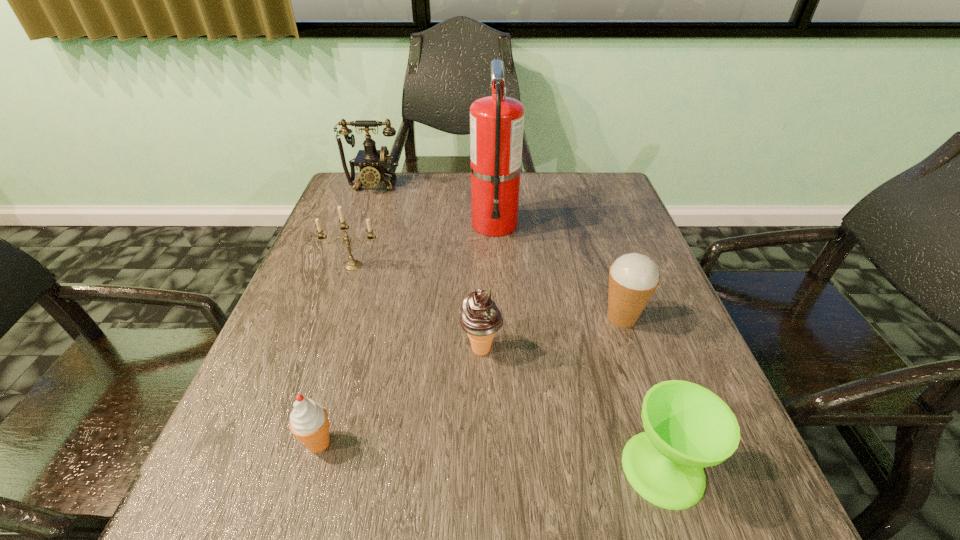
At what (x,y) coordinates should I click in order to perform the action: click on vacant space at the right edge of the desktop. Please return your answer as a coordinate pair (x, y). Looking at the image, I should click on click(x=588, y=248).

Image resolution: width=960 pixels, height=540 pixels. In order to click on vacant region at the far left corner in this screenshot , I will do `click(379, 199)`.

The width and height of the screenshot is (960, 540). Identify the location of free space between the wineglass and the rightmost icecream. (642, 393).

At what (x,y) coordinates should I click in order to perform the action: click on unoccupied area between the fifth nearest object and the second icecream from left to right. Please return your answer as a coordinate pair (x, y). Image resolution: width=960 pixels, height=540 pixels. Looking at the image, I should click on (418, 308).

This screenshot has width=960, height=540. I want to click on free spot between the fire extinguisher and the rightmost icecream, so click(558, 271).

Locate an element on the screen. The width and height of the screenshot is (960, 540). free spot between the candle and the tallest object is located at coordinates (423, 245).

Where is `vacant space in between the nearest icecream and the rightmost icecream`? The image size is (960, 540). vacant space in between the nearest icecream and the rightmost icecream is located at coordinates (470, 380).

Where is `free space between the farthest object and the rightmost icecream`? free space between the farthest object and the rightmost icecream is located at coordinates (497, 252).

This screenshot has width=960, height=540. Find the location of `unoccupied position between the wineglass and the second icecream from left to right`. unoccupied position between the wineglass and the second icecream from left to right is located at coordinates (572, 409).

Identify the location of free space between the second tallest object and the candle. This screenshot has height=540, width=960. (364, 226).